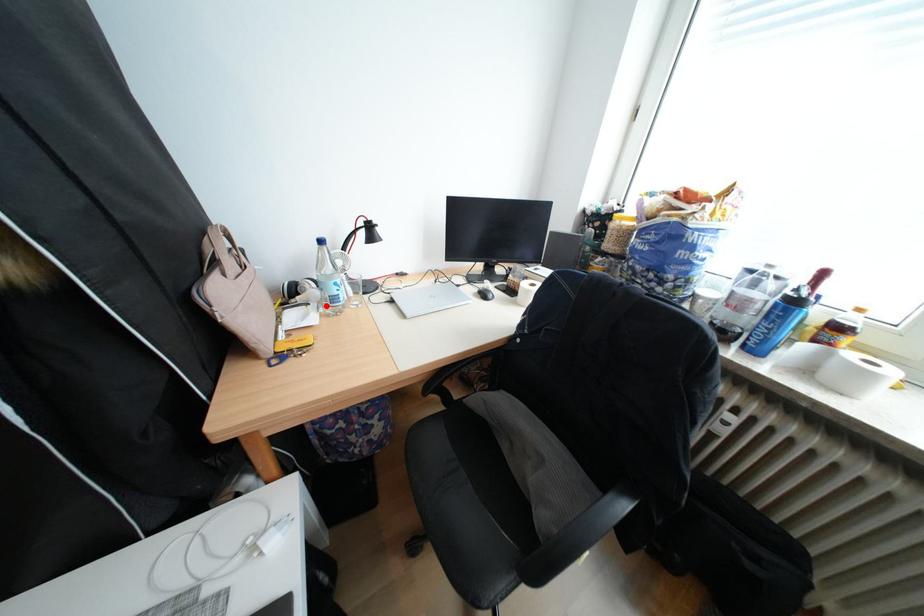
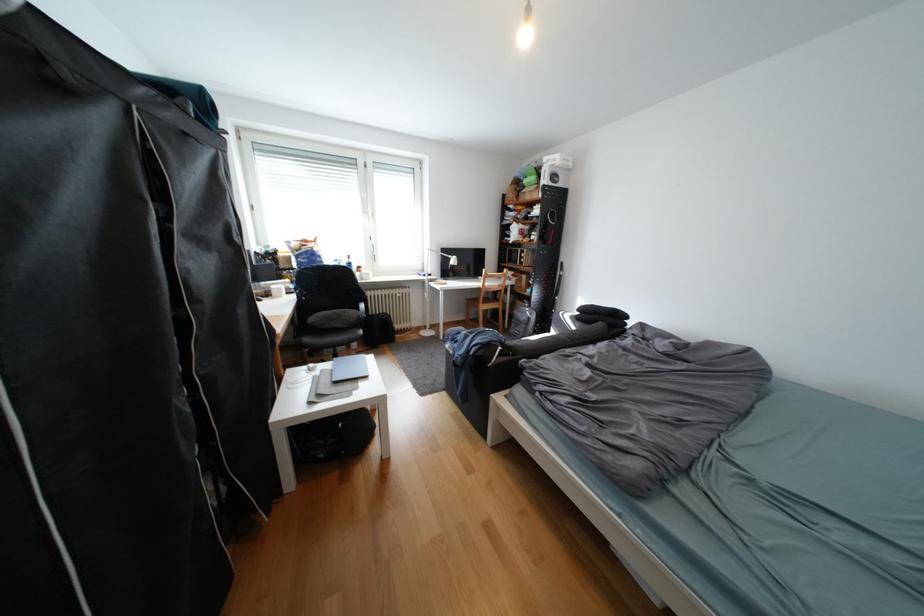
Question: I am providing you with two images of the same scene from different viewpoints. A red point is marked on the first image. Is the red point's position out of view in image 2?

Choices:
 (A) Yes
 (B) No

Answer: (A)